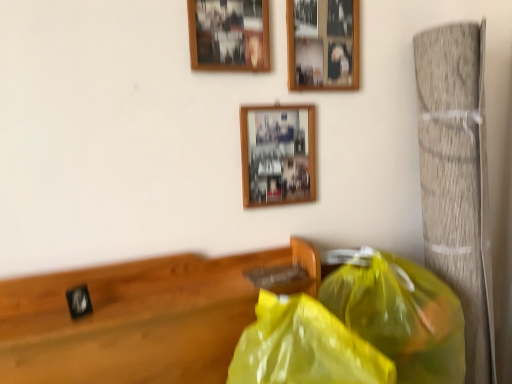
Question: Is yellow translucent plastic bag at lower right, which is counted as the 2th plastic bag, starting from the right, positioned before black matte clock at left?

Choices:
 (A) no
 (B) yes

Answer: (B)

Question: Is yellow translucent plastic bag at lower right, which is counted as the 2th plastic bag, starting from the right, at the right side of black matte clock at left?

Choices:
 (A) yes
 (B) no

Answer: (A)

Question: Is yellow translucent plastic bag at lower right, which is counted as the 2th plastic bag, starting from the right, turned away from black matte clock at left?

Choices:
 (A) no
 (B) yes

Answer: (A)

Question: From the image's perspective, does yellow translucent plastic bag at lower right, placed as the 1th plastic bag when sorted from left to right, appear lower than black matte clock at left?

Choices:
 (A) yes
 (B) no

Answer: (A)

Question: From a real-world perspective, is yellow translucent plastic bag at lower right, which is counted as the 2th plastic bag, starting from the right, physically above black matte clock at left?

Choices:
 (A) no
 (B) yes

Answer: (A)

Question: From the image's perspective, is black matte clock at left positioned above or below wooden picture frame at center, which is the third picture frame from top to bottom?

Choices:
 (A) below
 (B) above

Answer: (A)

Question: Considering their positions, is black matte clock at left located in front of or behind wooden picture frame at center, the 1th picture frame positioned from the bottom?

Choices:
 (A) behind
 (B) front

Answer: (B)

Question: Is point (205, 314) closer or farther from the camera than point (296, 153)?

Choices:
 (A) closer
 (B) farther

Answer: (A)

Question: From a real-world perspective, relative to wooden picture frame at center, the 1th picture frame positioned from the bottom, is black matte clock at left vertically above or below?

Choices:
 (A) below
 (B) above

Answer: (A)

Question: From the image's perspective, is yellow translucent plastic bag at lower right, placed as the 1th plastic bag when sorted from left to right, positioned above or below yellow translucent plastic bag at right, which is the second plastic bag in left-to-right order?

Choices:
 (A) above
 (B) below

Answer: (B)

Question: Considering their positions, is yellow translucent plastic bag at lower right, placed as the 1th plastic bag when sorted from left to right, located in front of or behind yellow translucent plastic bag at right, which is the second plastic bag in left-to-right order?

Choices:
 (A) behind
 (B) front

Answer: (B)

Question: In the image, is yellow translucent plastic bag at lower right, placed as the 1th plastic bag when sorted from left to right, on the left side or the right side of yellow translucent plastic bag at right, which is the first plastic bag from right to left?

Choices:
 (A) right
 (B) left

Answer: (B)

Question: Is yellow translucent plastic bag at lower right, placed as the 1th plastic bag when sorted from left to right, situated inside yellow translucent plastic bag at right, which is the second plastic bag in left-to-right order, or outside?

Choices:
 (A) inside
 (B) outside

Answer: (B)

Question: In the image, is yellow translucent plastic bag at lower right, which is counted as the 2th plastic bag, starting from the right, on the left side or the right side of wooden picture frame at upper center, the first picture frame in the top-to-bottom sequence?

Choices:
 (A) right
 (B) left

Answer: (A)

Question: In terms of size, does yellow translucent plastic bag at lower right, which is counted as the 2th plastic bag, starting from the right, appear bigger or smaller than wooden picture frame at upper center, the first picture frame in the top-to-bottom sequence?

Choices:
 (A) big
 (B) small

Answer: (A)